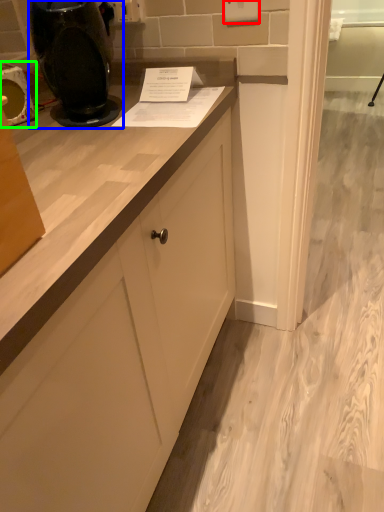
Question: Which object is the closest to the electric outlet (highlighted by a red box)? Choose among these: home appliance (highlighted by a blue box) or appliance (highlighted by a green box).

Choices:
 (A) home appliance
 (B) appliance

Answer: (A)